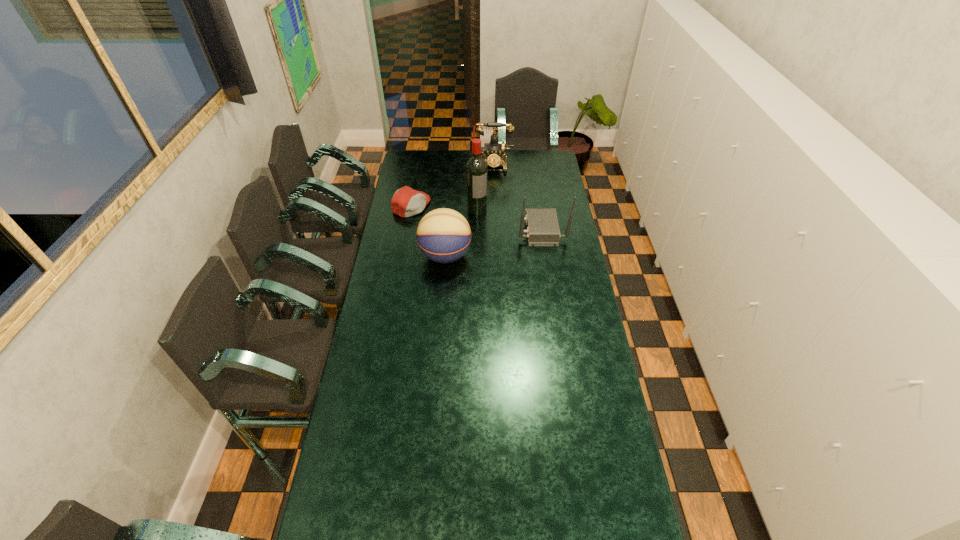
This screenshot has width=960, height=540. Identify the location of free space on the desktop that is between the basketball and the router and is positioned on the front of the farthest object, featuring the rotary dial. (491, 244).

Where is `vacant spot on the desktop that is between the basketball and the router and is positioned on the front-facing side of the shortest object`? This screenshot has width=960, height=540. vacant spot on the desktop that is between the basketball and the router and is positioned on the front-facing side of the shortest object is located at coordinates (495, 242).

Where is `free space on the desktop that is between the basketball and the router and is positioned on the label of the wine bottle`? free space on the desktop that is between the basketball and the router and is positioned on the label of the wine bottle is located at coordinates (498, 241).